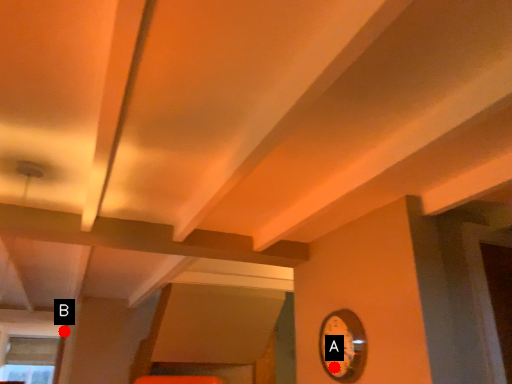
Question: Two points are circled on the image, labeled by A and B beside each circle. Which point is farther from the camera taking this photo?

Choices:
 (A) A is further
 (B) B is further

Answer: (B)